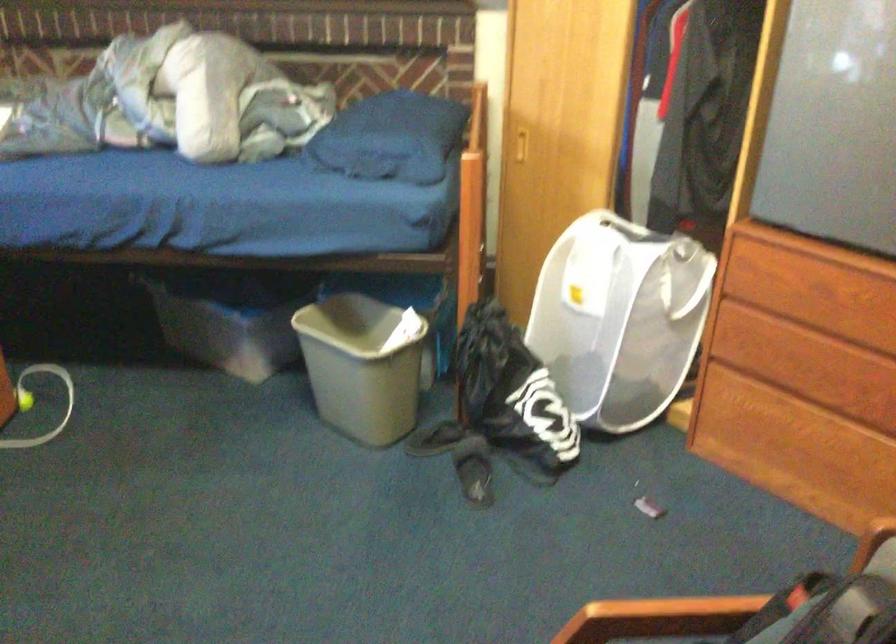
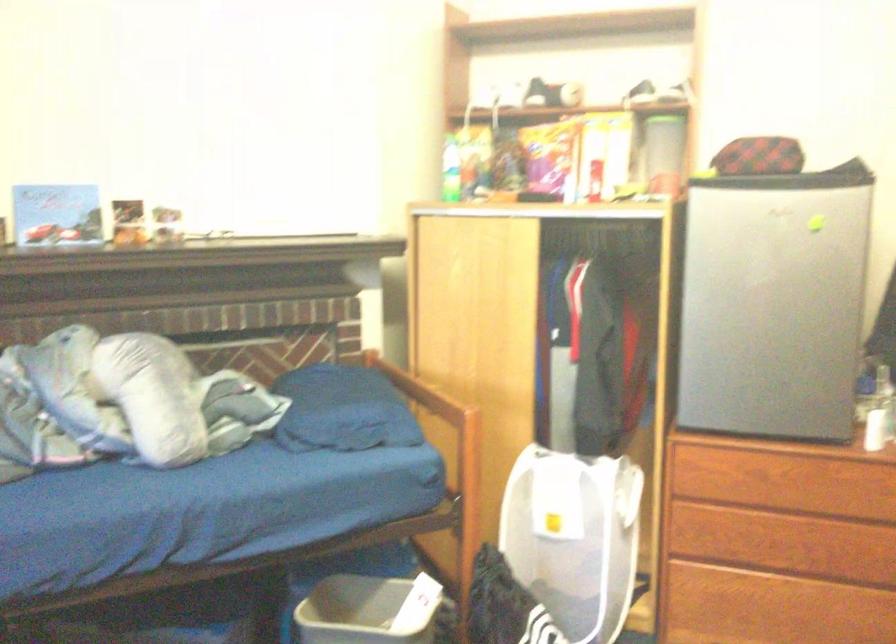
Question: I am providing you with two images of the same scene from different viewpoints. After the viewpoint changes to image2, which objects are now occluded?

Choices:
 (A) dresser drawer handle
 (B) clear plastic container
 (C) black dish rack
 (D) purple food box

Answer: (A)